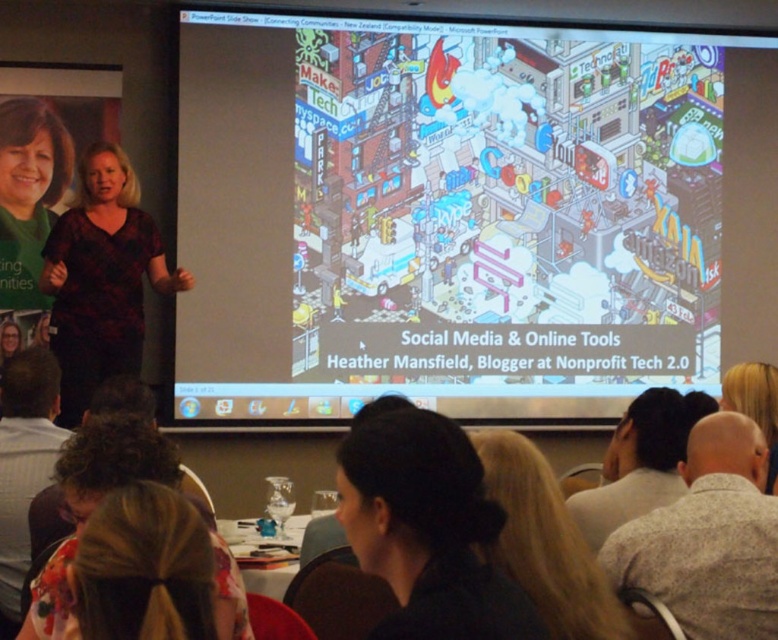
Question: Is green matte shirt at upper left positioned before blonde hair at upper right?

Choices:
 (A) no
 (B) yes

Answer: (A)

Question: Does blonde hair at lower left appear on the right side of blonde hair at upper right?

Choices:
 (A) no
 (B) yes

Answer: (A)

Question: Among these points, which one is nearest to the camera?

Choices:
 (A) (51, 120)
 (B) (373, 560)
 (C) (764, 499)

Answer: (B)

Question: Which of the following is the farthest from the observer?

Choices:
 (A) (633, 429)
 (B) (163, 588)
 (C) (55, 378)

Answer: (C)

Question: Can you confirm if cartoonish illustration at center is wider than gray wool sweater at lower right?

Choices:
 (A) no
 (B) yes

Answer: (B)

Question: Which is nearer to the blonde hair at lower center?

Choices:
 (A) black hair bun at center
 (B) blonde hair at upper right

Answer: (A)